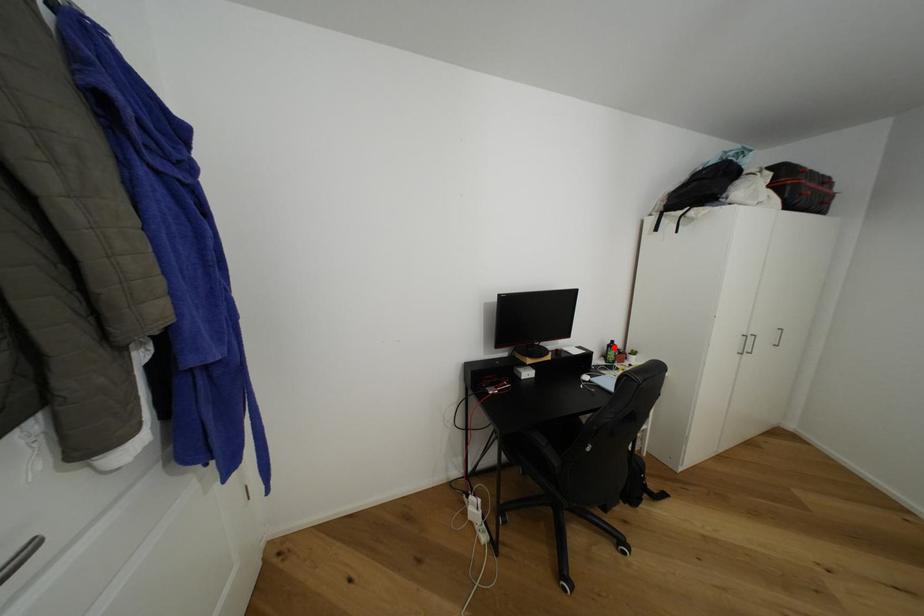
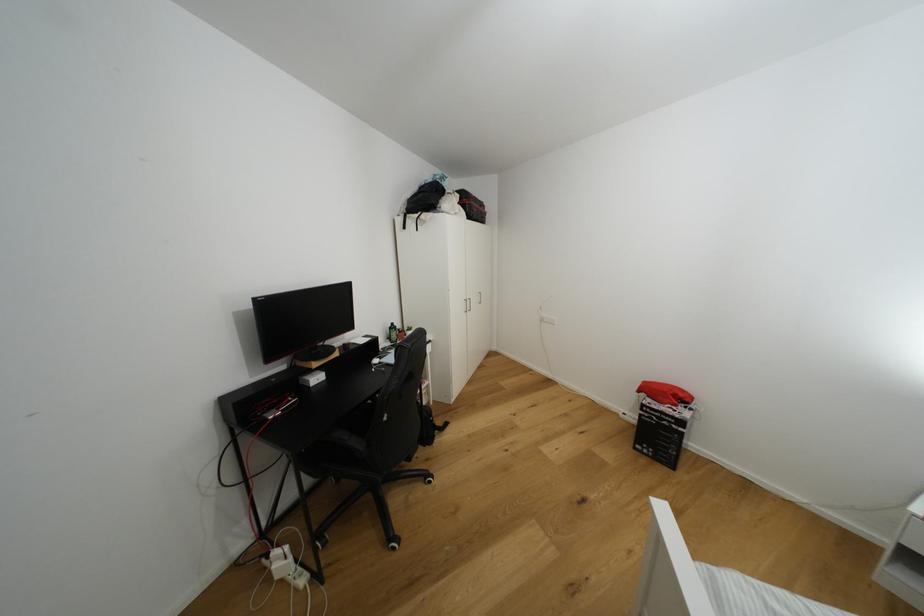
Question: I am providing you with two images of the same scene from different viewpoints. In image1, a red point is highlighted. Considering the same 3D point in image2, which of the following is correct?

Choices:
 (A) It is closer
 (B) It is farther

Answer: (A)